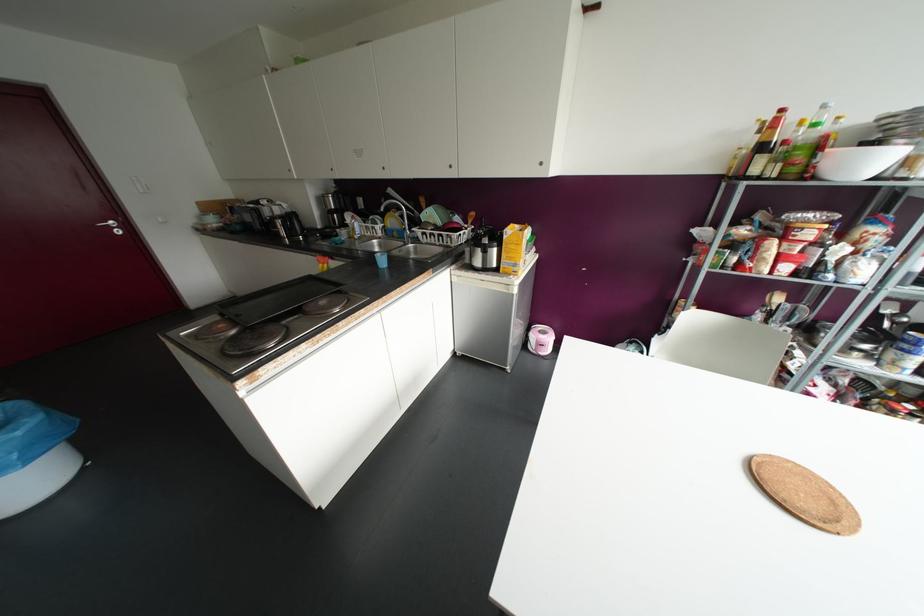
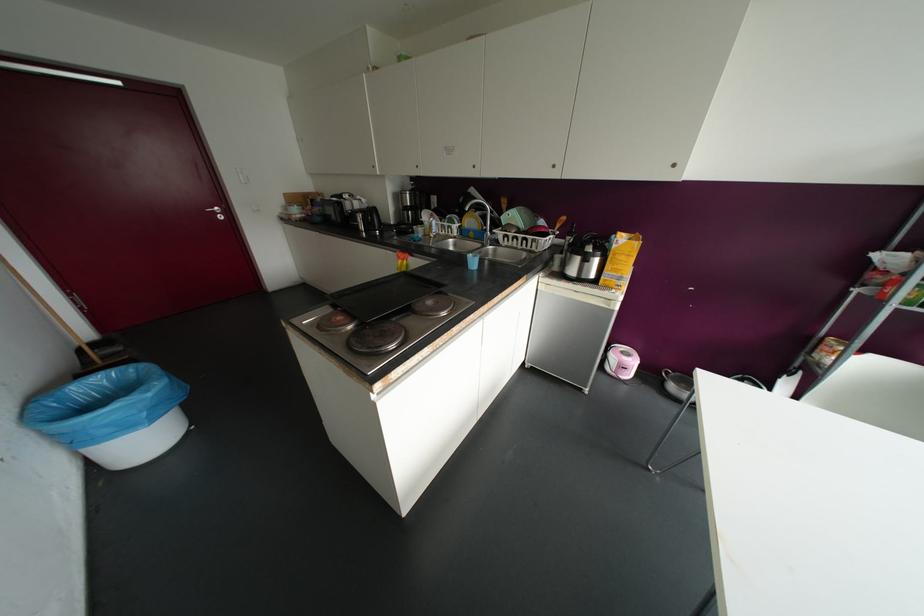
The point at (408,229) is marked in the first image. Where is the corresponding point in the second image?

(490, 230)